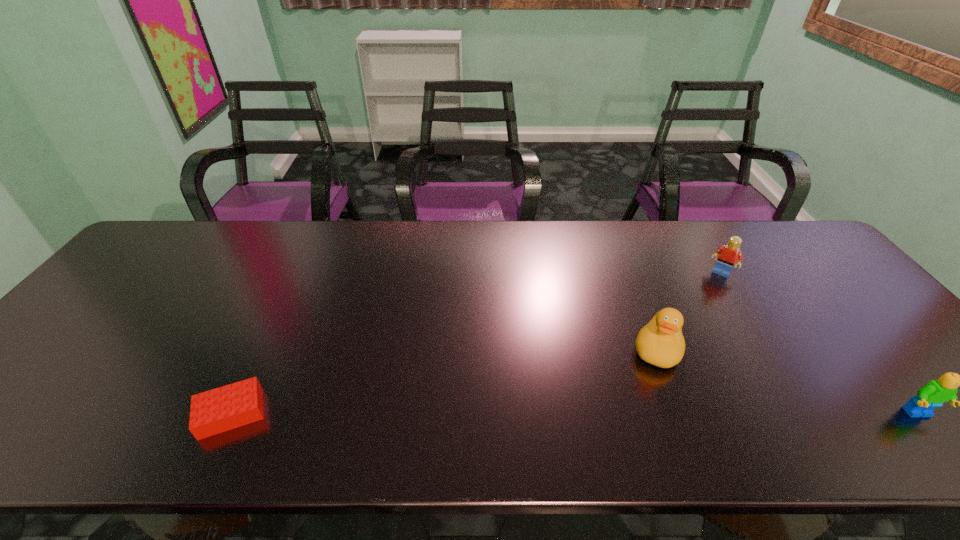
Identify which object is located as the third nearest to the shortest Lego. Please provide its 2D coordinates. Your answer should be formatted as a tuple, i.e. [(x, y)], where the tuple contains the x and y coordinates of a point satisfying the conditions above.

[(936, 392)]

Identify which object is located as the nearest to the farthest Lego. Please provide its 2D coordinates. Your answer should be formatted as a tuple, i.e. [(x, y)], where the tuple contains the x and y coordinates of a point satisfying the conditions above.

[(661, 343)]

Identify which Lego is located as the second nearest to the rightmost object. Please provide its 2D coordinates. Your answer should be formatted as a tuple, i.e. [(x, y)], where the tuple contains the x and y coordinates of a point satisfying the conditions above.

[(218, 410)]

Locate which Lego is the second closest to the rightmost Lego. Please provide its 2D coordinates. Your answer should be formatted as a tuple, i.e. [(x, y)], where the tuple contains the x and y coordinates of a point satisfying the conditions above.

[(218, 410)]